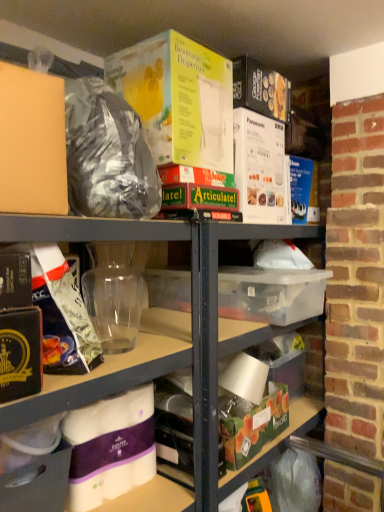
Identify the location of green matte storage box at lower center, the second storage box when ordered from bottom to top. (251, 423).

Find the location of a particular element. The image size is (384, 512). shiny metallic bag at upper left is located at coordinates (107, 154).

How much space does transparent plastic storage box at center, arranged as the 3th storage box when ordered from the bottom, occupy horizontally?

transparent plastic storage box at center, arranged as the 3th storage box when ordered from the bottom, is 28.69 inches wide.

Describe the element at coordinates (271, 294) in the screenshot. The height and width of the screenshot is (512, 384). I see `transparent plastic storage box at center, acting as the second storage box starting from the right` at that location.

What do you see at coordinates (110, 447) in the screenshot? I see `purple paper towel at lower left, positioned as the 1th yoghurt in bottom-to-top order` at bounding box center [110, 447].

Describe the element at coordinates (178, 99) in the screenshot. This screenshot has height=512, width=384. I see `yellow cardboard beverage dispenser at upper center, positioned as the 1th yoghurt in top-to-bottom order` at that location.

You are a GUI agent. You are given a task and a screenshot of the screen. Output one action in this format:
    pyautogui.click(x=<x>, y=<y>)
    Task: Click on the green matte storage box at lower center, placed as the 1th storage box when sorted from right to left
    The image size is (384, 512).
    Given the screenshot: What is the action you would take?
    pyautogui.click(x=251, y=423)

Is shiny metallic bag at upper left not close to purple paper towel at lower left, positioned as the 1th yoghurt in bottom-to-top order?

No, there isn't a large distance between shiny metallic bag at upper left and purple paper towel at lower left, positioned as the 1th yoghurt in bottom-to-top order.

The image size is (384, 512). Identify the location of the 2nd yoghurt to the left of the shiny metallic bag at upper left, counting from the anchor's position. (110, 447).

How different are the orientations of shiny metallic bag at upper left and purple paper towel at lower left, which ranks as the 3th yoghurt in top-to-bottom order, in degrees?

0.979 degrees separate the facing orientations of shiny metallic bag at upper left and purple paper towel at lower left, which ranks as the 3th yoghurt in top-to-bottom order.

From their relative heights in the image, would you say shiny metallic bag at upper left is taller or shorter than purple paper towel at lower left, which ranks as the 3th yoghurt in top-to-bottom order?

Considering their sizes, shiny metallic bag at upper left has more height than purple paper towel at lower left, which ranks as the 3th yoghurt in top-to-bottom order.

From the green matte storage box at lower center, the second storage box when ordered from bottom to top, count 3rd yoghurts forward and point to it. Please provide its 2D coordinates.

[(110, 447)]

Based on their sizes in the image, would you say purple paper towel at lower left, which ranks as the 3th yoghurt in top-to-bottom order, is bigger or smaller than green matte storage box at lower center, the second storage box when ordered from bottom to top?

purple paper towel at lower left, which ranks as the 3th yoghurt in top-to-bottom order, is smaller than green matte storage box at lower center, the second storage box when ordered from bottom to top.

From the image's perspective, which object appears higher, purple paper towel at lower left, positioned as the 1th yoghurt in bottom-to-top order, or green matte storage box at lower center, positioned as the second storage box in top-to-bottom order?

From the image's view, purple paper towel at lower left, positioned as the 1th yoghurt in bottom-to-top order, is above.

In the image, is purple paper towel at lower left, positioned as the 1th yoghurt in bottom-to-top order, positioned in front of or behind green matte storage box at lower center, the second storage box when ordered from bottom to top?

purple paper towel at lower left, positioned as the 1th yoghurt in bottom-to-top order, is positioned closer to the viewer than green matte storage box at lower center, the second storage box when ordered from bottom to top.

From a real-world perspective, who is located lower, purple paper towel at lower left, positioned as the 1th yoghurt in bottom-to-top order, or transparent plastic storage box at center, placed as the second storage box when sorted from left to right?

purple paper towel at lower left, positioned as the 1th yoghurt in bottom-to-top order, from a real-world perspective.

Which is in front, point (92, 412) or point (311, 292)?

Point (92, 412)

Is purple paper towel at lower left, which ranks as the 3th yoghurt in top-to-bottom order, facing towards transparent plastic storage box at center, arranged as the 3th storage box when ordered from the bottom?

No, purple paper towel at lower left, which ranks as the 3th yoghurt in top-to-bottom order, is not turned towards transparent plastic storage box at center, arranged as the 3th storage box when ordered from the bottom.

From the image's perspective, does purple paper towel at lower left, which ranks as the 3th yoghurt in top-to-bottom order, appear higher than transparent plastic storage box at center, acting as the second storage box starting from the right?

Actually, purple paper towel at lower left, which ranks as the 3th yoghurt in top-to-bottom order, appears below transparent plastic storage box at center, acting as the second storage box starting from the right, in the image.

Does yellow cardboard beverage dispenser at upper center, positioned as the 1th yoghurt in top-to-bottom order, have a greater width compared to green matte storage box at lower center, the second storage box when ordered from bottom to top?

Yes.

From the picture: Are yellow cardboard beverage dispenser at upper center, positioned as the 1th yoghurt in top-to-bottom order, and green matte storage box at lower center, the second storage box when ordered from bottom to top, making contact?

No, yellow cardboard beverage dispenser at upper center, positioned as the 1th yoghurt in top-to-bottom order, is not with green matte storage box at lower center, the second storage box when ordered from bottom to top.

Is point (181, 96) behind point (275, 420)?

No, (181, 96) is closer to viewer.

There is a yellow cardboard beverage dispenser at upper center, marked as the third yoghurt in a bottom-to-top arrangement. At what (x,y) coordinates should I click in order to perform the action: click on the 3rd storage box below it (from a real-world perspective). Please return your answer as a coordinate pair (x, y). The height and width of the screenshot is (512, 384). Looking at the image, I should click on (251, 423).

From the shiny metallic bag at upper left, count 3rd yoghurts backward and point to it. Please provide its 2D coordinates.

[(178, 99)]

From a real-world perspective, is shiny metallic bag at upper left under yellow cardboard beverage dispenser at upper center, positioned as the 1th yoghurt in top-to-bottom order?

Correct, in the physical world, shiny metallic bag at upper left is lower than yellow cardboard beverage dispenser at upper center, positioned as the 1th yoghurt in top-to-bottom order.

In terms of height, does shiny metallic bag at upper left look taller or shorter compared to yellow cardboard beverage dispenser at upper center, positioned as the 1th yoghurt in top-to-bottom order?

In the image, shiny metallic bag at upper left appears to be shorter than yellow cardboard beverage dispenser at upper center, positioned as the 1th yoghurt in top-to-bottom order.

In the scene shown: Is shiny metallic bag at upper left turned away from yellow cardboard beverage dispenser at upper center, positioned as the 1th yoghurt in top-to-bottom order?

No, shiny metallic bag at upper left is not facing the opposite direction of yellow cardboard beverage dispenser at upper center, positioned as the 1th yoghurt in top-to-bottom order.

How distant is transparent plastic storage box at center, acting as the second storage box starting from the right, from white cardboard box at lower left, which is counted as the third storage box, starting from the top?

They are 34.60 inches apart.

Does transparent plastic storage box at center, arranged as the 3th storage box when ordered from the bottom, appear on the right side of white cardboard box at lower left, which ranks as the 1th storage box in bottom-to-top order?

Yes.

From the image's perspective, which object appears higher, transparent plastic storage box at center, the 1th storage box viewed from the top, or white cardboard box at lower left, which ranks as the 1th storage box in bottom-to-top order?

transparent plastic storage box at center, the 1th storage box viewed from the top, appears higher in the image.

What's the angular difference between transparent plastic storage box at center, the 1th storage box viewed from the top, and white cardboard box at lower left, the first storage box from the left,'s facing directions?

transparent plastic storage box at center, the 1th storage box viewed from the top, and white cardboard box at lower left, the first storage box from the left, are facing 6.36 degrees away from each other.

From the image's perspective, which one is positioned lower, yellow cardboard beverage dispenser at upper center, positioned as the 1th yoghurt in top-to-bottom order, or shiny metallic bag at upper left?

shiny metallic bag at upper left, from the image's perspective.

Who is shorter, yellow cardboard beverage dispenser at upper center, marked as the third yoghurt in a bottom-to-top arrangement, or shiny metallic bag at upper left?

Standing shorter between the two is shiny metallic bag at upper left.

Is yellow cardboard beverage dispenser at upper center, positioned as the 1th yoghurt in top-to-bottom order, far away from shiny metallic bag at upper left?

yellow cardboard beverage dispenser at upper center, positioned as the 1th yoghurt in top-to-bottom order, is actually quite close to shiny metallic bag at upper left.

From the image's perspective, starting from the shiny metallic bag at upper left, which yoghurt is the 2nd one below? Please provide its 2D coordinates.

[(110, 447)]

In order to click on the 1st yoghurt above the green matte storage box at lower center, positioned as the second storage box in top-to-bottom order (from the image's perspective) in this screenshot , I will do `click(110, 447)`.

Estimate the real-world distances between objects in this image. Which object is further from green matte storage box at lower center, positioned as the second storage box in top-to-bottom order, purple paper towel at lower left, which ranks as the 3th yoghurt in top-to-bottom order, or shiny metallic bag at upper left?

Based on the image, shiny metallic bag at upper left appears to be further to green matte storage box at lower center, positioned as the second storage box in top-to-bottom order.

Based on their spatial positions, is yellow cardboard beverage dispenser at upper center, positioned as the 1th yoghurt in top-to-bottom order, or transparent plastic storage box at center, placed as the second storage box when sorted from left to right, further from transparent plastic jar at center, which is the second yoghurt from bottom to top?

Based on the image, yellow cardboard beverage dispenser at upper center, positioned as the 1th yoghurt in top-to-bottom order, appears to be further to transparent plastic jar at center, which is the second yoghurt from bottom to top.

From the image, which object appears to be farther from purple paper towel at lower left, positioned as the 1th yoghurt in bottom-to-top order, transparent plastic storage box at center, acting as the second storage box starting from the right, or green matte storage box at lower center, the second storage box when ordered from bottom to top?

transparent plastic storage box at center, acting as the second storage box starting from the right, lies further to purple paper towel at lower left, positioned as the 1th yoghurt in bottom-to-top order, than the other object.

Which object lies further to the anchor point shiny metallic bag at upper left, transparent plastic storage box at center, the 1th storage box viewed from the top, or transparent plastic jar at center, positioned as the second yoghurt in top-to-bottom order?

transparent plastic storage box at center, the 1th storage box viewed from the top, is positioned further to the anchor shiny metallic bag at upper left.

When comparing their distances from shiny metallic bag at upper left, does purple paper towel at lower left, which ranks as the 3th yoghurt in top-to-bottom order, or transparent plastic jar at center, positioned as the second yoghurt in top-to-bottom order, seem further?

purple paper towel at lower left, which ranks as the 3th yoghurt in top-to-bottom order, is positioned further to the anchor shiny metallic bag at upper left.

Based on their spatial positions, is transparent plastic jar at center, positioned as the second yoghurt in top-to-bottom order, or purple paper towel at lower left, which ranks as the 3th yoghurt in top-to-bottom order, closer to yellow cardboard beverage dispenser at upper center, positioned as the 1th yoghurt in top-to-bottom order?

The object closer to yellow cardboard beverage dispenser at upper center, positioned as the 1th yoghurt in top-to-bottom order, is transparent plastic jar at center, positioned as the second yoghurt in top-to-bottom order.

Based on their spatial positions, is white cardboard box at lower left, the first storage box from the left, or purple paper towel at lower left, which ranks as the 3th yoghurt in top-to-bottom order, closer to yellow cardboard beverage dispenser at upper center, positioned as the 1th yoghurt in top-to-bottom order?

Among the two, purple paper towel at lower left, which ranks as the 3th yoghurt in top-to-bottom order, is located nearer to yellow cardboard beverage dispenser at upper center, positioned as the 1th yoghurt in top-to-bottom order.

When comparing their distances from transparent plastic storage box at center, arranged as the 3th storage box when ordered from the bottom, does yellow cardboard beverage dispenser at upper center, marked as the third yoghurt in a bottom-to-top arrangement, or shiny metallic bag at upper left seem further?

shiny metallic bag at upper left lies further to transparent plastic storage box at center, arranged as the 3th storage box when ordered from the bottom, than the other object.

Find the location of a particular element. This screenshot has height=512, width=384. storage box that lies between transparent plastic jar at center, which is the second yoghurt from bottom to top, and purple paper towel at lower left, which ranks as the 3th yoghurt in top-to-bottom order, from top to bottom is located at coordinates (271, 294).

At what (x,y) coordinates should I click in order to perform the action: click on yoghurt between yellow cardboard beverage dispenser at upper center, positioned as the 1th yoghurt in top-to-bottom order, and purple paper towel at lower left, positioned as the 1th yoghurt in bottom-to-top order, in the vertical direction. Please return your answer as a coordinate pair (x, y). This screenshot has width=384, height=512. Looking at the image, I should click on (113, 295).

This screenshot has width=384, height=512. Identify the location of storage box between yellow cardboard beverage dispenser at upper center, marked as the third yoghurt in a bottom-to-top arrangement, and purple paper towel at lower left, which ranks as the 3th yoghurt in top-to-bottom order, in the up-down direction. (271, 294).

Locate an element on the screen. This screenshot has width=384, height=512. yoghurt between shiny metallic bag at upper left and purple paper towel at lower left, positioned as the 1th yoghurt in bottom-to-top order, in the up-down direction is located at coordinates (113, 295).